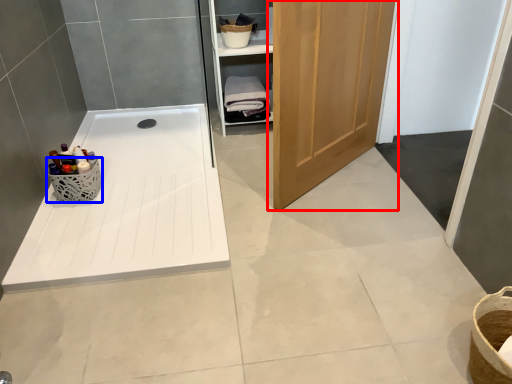
Question: Which of the following is the closest to the observer, door (highlighted by a red box) or basket (highlighted by a blue box)?

Choices:
 (A) door
 (B) basket

Answer: (A)